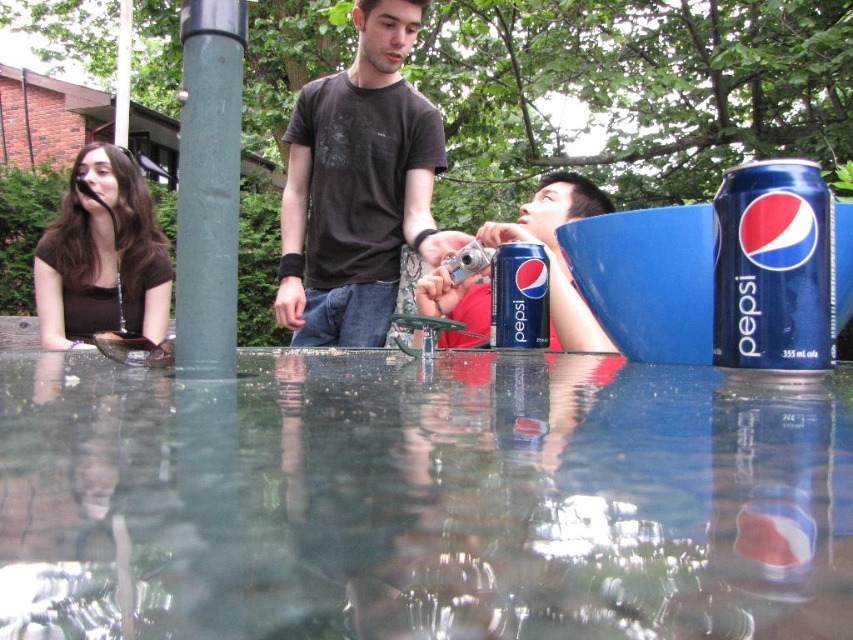
Is transparent glass water at center positioned in front of green matte pole at left?

That is True.

Does transparent glass water at center have a lesser width compared to green matte pole at left?

Incorrect, transparent glass water at center's width is not less than green matte pole at left's.

Find the location of a particular element. The image size is (853, 640). transparent glass water at center is located at coordinates (421, 500).

Based on the photo, can you confirm if brown matte shirt at left is wider than blue metallic can at center?

Yes.

Locate an element on the screen. The image size is (853, 640). brown matte shirt at left is located at coordinates (102, 256).

Does dark brown cotton t-shirt at center have a greater width compared to green matte pole at left?

Yes.

Is dark brown cotton t-shirt at center positioned at the back of green matte pole at left?

Yes, it is behind green matte pole at left.

The height and width of the screenshot is (640, 853). In order to click on dark brown cotton t-shirt at center in this screenshot , I will do `click(358, 188)`.